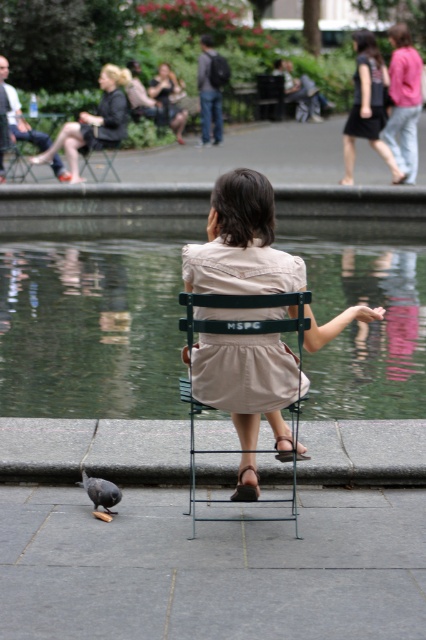
Is beige fabric dress at center above matte black jacket at upper left?

Actually, beige fabric dress at center is below matte black jacket at upper left.

Can you confirm if beige fabric dress at center is positioned to the left of matte black jacket at upper left?

No, beige fabric dress at center is not to the left of matte black jacket at upper left.

Which is in front, point (287, 282) or point (123, 136)?

Point (287, 282)

The width and height of the screenshot is (426, 640). I want to click on beige fabric dress at center, so click(241, 243).

Can you confirm if beige cotton dress at center is shorter than metallic green chair at left?

Yes.

Between beige cotton dress at center and metallic green chair at left, which one is positioned lower?

Positioned lower is beige cotton dress at center.

Which is in front, point (293, 275) or point (17, 148)?

Positioned in front is point (293, 275).

Where is `beige cotton dress at center`? The width and height of the screenshot is (426, 640). beige cotton dress at center is located at coordinates (244, 372).

Between green reflective water at center and metallic green chair at left, which one has more height?

metallic green chair at left is taller.

In the scene shown: How distant is green reflective water at center from metallic green chair at left?

green reflective water at center is 6.94 meters away from metallic green chair at left.

Is point (376, 252) more distant than point (16, 134)?

That is False.

The image size is (426, 640). I want to click on green reflective water at center, so click(91, 326).